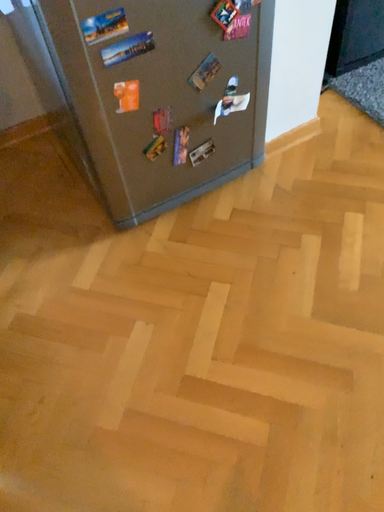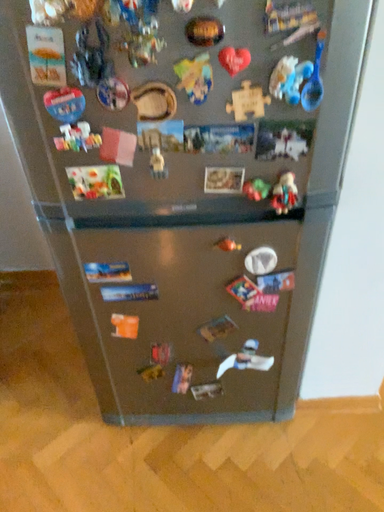
Question: How did the camera likely rotate when shooting the video?

Choices:
 (A) rotated left
 (B) rotated right

Answer: (A)